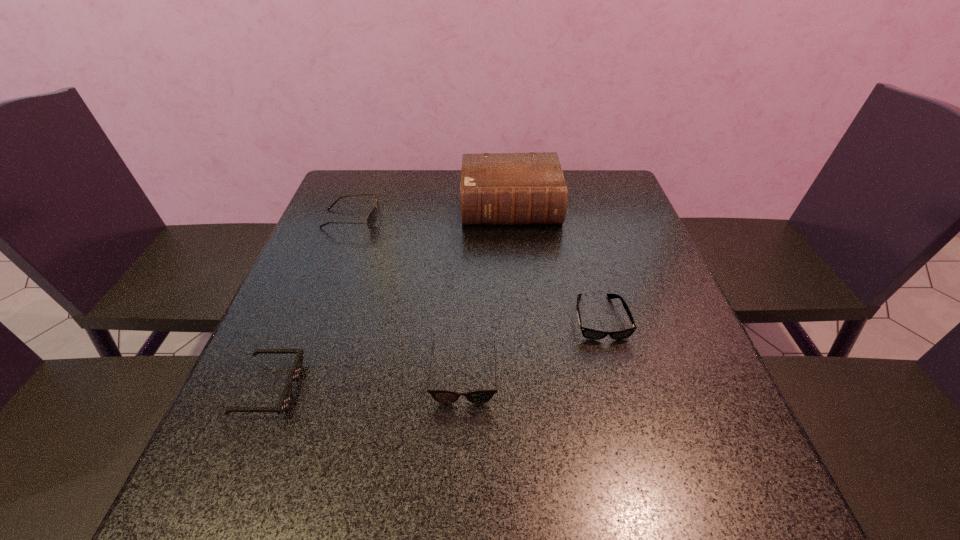
Image resolution: width=960 pixels, height=540 pixels. In order to click on the second closest object to the tallest sunglasses in this screenshot , I will do `click(285, 399)`.

Where is `the closest sunglasses to the third nearest sunglasses`? the closest sunglasses to the third nearest sunglasses is located at coordinates 442,396.

At what (x,y) coordinates should I click in order to perform the action: click on the third closest sunglasses to the second sunglasses from right to left. Please return your answer as a coordinate pair (x, y). The height and width of the screenshot is (540, 960). Looking at the image, I should click on (372, 217).